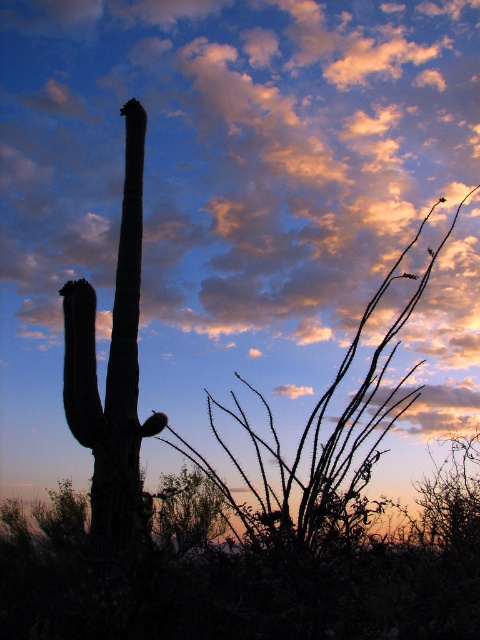
Between orange cotton cloud at upper center and silhouette cactus at left, which one has less height?

Standing shorter between the two is orange cotton cloud at upper center.

Can you confirm if orange cotton cloud at upper center is positioned to the left of silhouette cactus at left?

Indeed, orange cotton cloud at upper center is positioned on the left side of silhouette cactus at left.

Locate an element on the screen. The image size is (480, 640). orange cotton cloud at upper center is located at coordinates (230, 154).